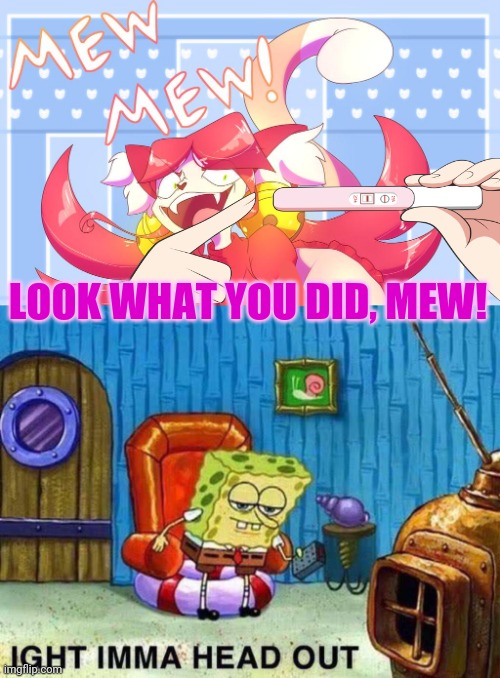
Locate an element on the screen. The width and height of the screenshot is (500, 678). door is located at coordinates (59, 481).